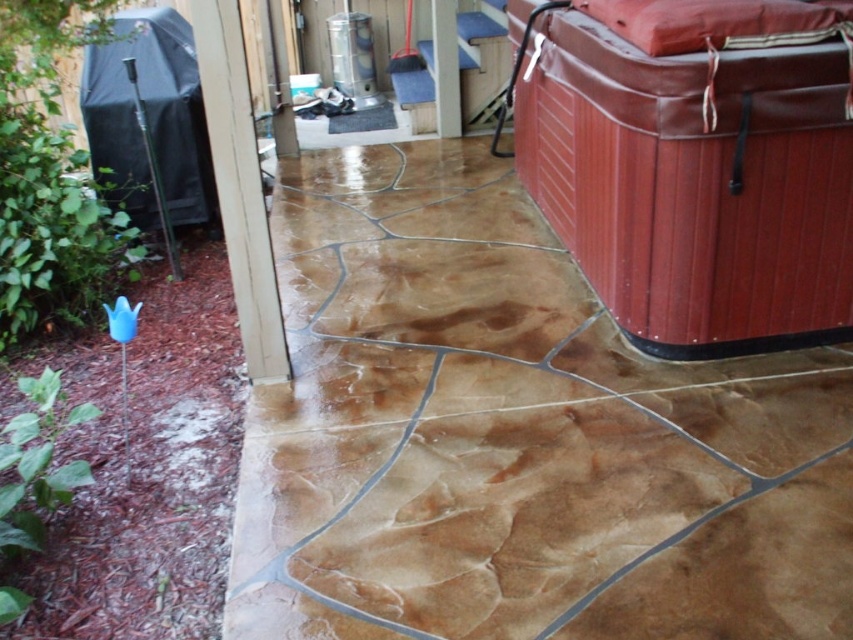
Question: In this image, where is brown textured hot tub at right located relative to brown textured tile at center?

Choices:
 (A) left
 (B) right

Answer: (B)

Question: Which object appears closest to the camera in this image?

Choices:
 (A) brown textured hot tub at right
 (B) brown textured tile at center

Answer: (A)

Question: Which object appears closest to the camera in this image?

Choices:
 (A) brown textured tile at center
 (B) brown textured concrete at center
 (C) brown textured hot tub at right

Answer: (B)

Question: In this image, where is brown textured hot tub at right located relative to brown textured tile at center?

Choices:
 (A) above
 (B) below

Answer: (A)

Question: Which is nearer to the brown textured tile at center?

Choices:
 (A) brown textured hot tub at right
 (B) brown textured concrete at center

Answer: (B)

Question: Observing the image, what is the correct spatial positioning of brown textured concrete at center in reference to brown textured tile at center?

Choices:
 (A) below
 (B) above

Answer: (A)